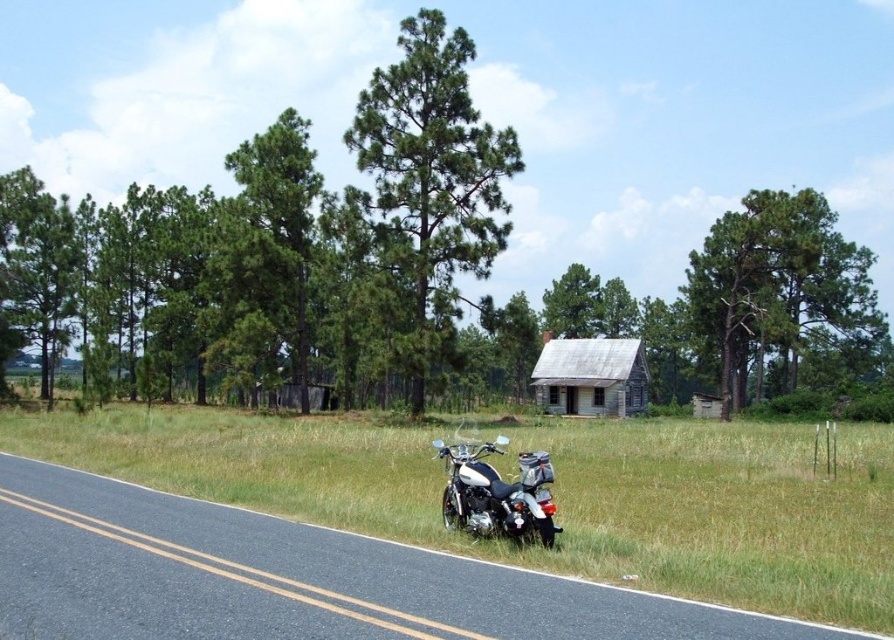
Who is more forward, (x=439, y=301) or (x=758, y=262)?

Positioned in front is point (x=439, y=301).

Can you confirm if green pine tree at center is positioned above green textured tree at upper right?

No.

Find the location of a particular element. The height and width of the screenshot is (640, 894). green pine tree at center is located at coordinates (428, 186).

Is green pine tree at center thinner than weathered wood cabin at center?

No, green pine tree at center is not thinner than weathered wood cabin at center.

Describe the element at coordinates (428, 186) in the screenshot. The image size is (894, 640). I see `green pine tree at center` at that location.

Where is `green pine tree at center`? The image size is (894, 640). green pine tree at center is located at coordinates (428, 186).

Which is more to the left, green grass at lower center or weathered wood cabin at center?

Positioned to the left is green grass at lower center.

Who is positioned more to the right, green grass at lower center or weathered wood cabin at center?

From the viewer's perspective, weathered wood cabin at center appears more on the right side.

What do you see at coordinates (552, 490) in the screenshot? Image resolution: width=894 pixels, height=640 pixels. I see `green grass at lower center` at bounding box center [552, 490].

At what (x,y) coordinates should I click in order to perform the action: click on green grass at lower center. Please return your answer as a coordinate pair (x, y). This screenshot has width=894, height=640. Looking at the image, I should click on (552, 490).